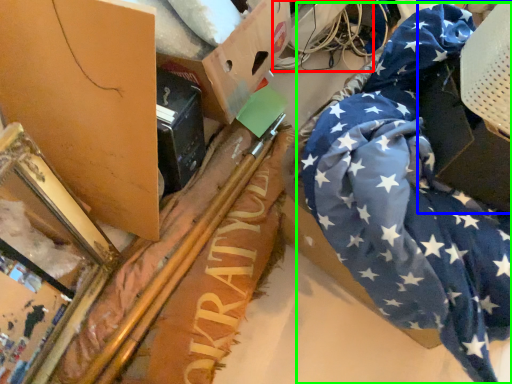
Question: Estimate the real-world distances between objects in this image. Which object is closer to wire (highlighted by a red box), cardboard box (highlighted by a blue box) or flag (highlighted by a green box)?

Choices:
 (A) cardboard box
 (B) flag

Answer: (B)